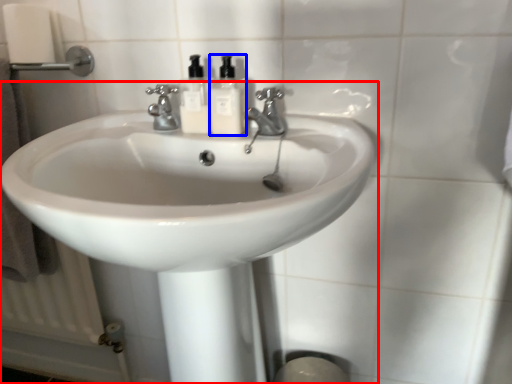
Question: Which object is closer to the camera taking this photo, sink (highlighted by a red box) or soap dispenser (highlighted by a blue box)?

Choices:
 (A) sink
 (B) soap dispenser

Answer: (A)